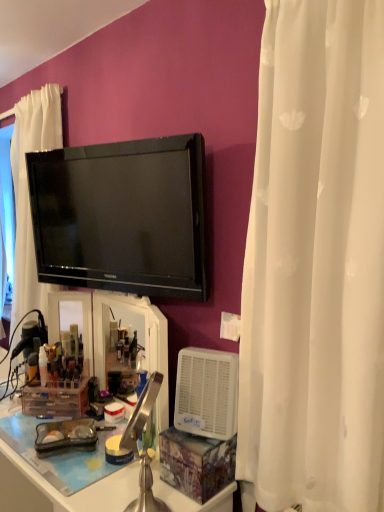
Question: Is white plastic desk at lower left positioned before white sheer curtain at right?

Choices:
 (A) yes
 (B) no

Answer: (B)

Question: From a real-world perspective, is white plastic desk at lower left located beneath white sheer curtain at right?

Choices:
 (A) yes
 (B) no

Answer: (A)

Question: Considering the relative sizes of white plastic desk at lower left and white sheer curtain at right in the image provided, is white plastic desk at lower left bigger than white sheer curtain at right?

Choices:
 (A) yes
 (B) no

Answer: (A)

Question: Is white plastic desk at lower left at the left side of white sheer curtain at right?

Choices:
 (A) no
 (B) yes

Answer: (B)

Question: Is white sheer curtain at right completely or partially inside white plastic desk at lower left?

Choices:
 (A) yes
 (B) no

Answer: (B)

Question: From a real-world perspective, is white plastic desk at lower left physically above white sheer curtain at right?

Choices:
 (A) no
 (B) yes

Answer: (A)

Question: From a real-world perspective, is translucent plastic container at lower left, which is the first toiletry from right to left, under matte gold tube at left, positioned as the 2th toiletry in right-to-left order?

Choices:
 (A) no
 (B) yes

Answer: (A)

Question: Does translucent plastic container at lower left, which is counted as the second toiletry, starting from the left, appear on the left side of matte gold tube at left, positioned as the 2th toiletry in right-to-left order?

Choices:
 (A) no
 (B) yes

Answer: (A)

Question: Does translucent plastic container at lower left, which is counted as the second toiletry, starting from the left, turn towards matte gold tube at left, the first toiletry viewed from the left?

Choices:
 (A) no
 (B) yes

Answer: (A)

Question: From the image's perspective, is translucent plastic container at lower left, which is counted as the second toiletry, starting from the left, above matte gold tube at left, the first toiletry viewed from the left?

Choices:
 (A) yes
 (B) no

Answer: (A)

Question: Is translucent plastic container at lower left, which is the first toiletry from right to left, closer to the viewer compared to matte gold tube at left, the first toiletry viewed from the left?

Choices:
 (A) no
 (B) yes

Answer: (A)

Question: Can you confirm if translucent plastic container at lower left, which is counted as the second toiletry, starting from the left, is taller than matte gold tube at left, the first toiletry viewed from the left?

Choices:
 (A) yes
 (B) no

Answer: (A)

Question: Is black glossy tv at upper center facing away from matte gold tube at left, positioned as the 2th toiletry in right-to-left order?

Choices:
 (A) yes
 (B) no

Answer: (B)